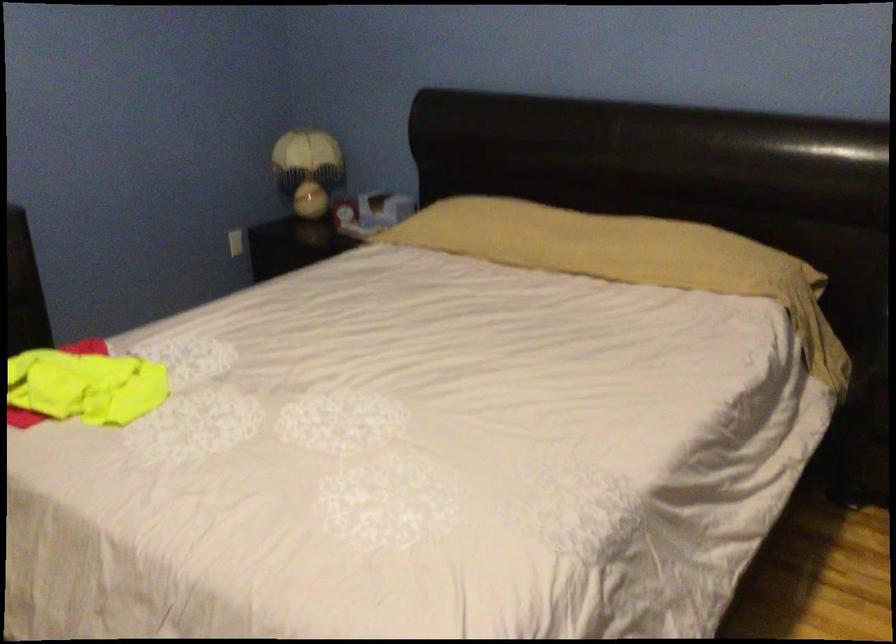
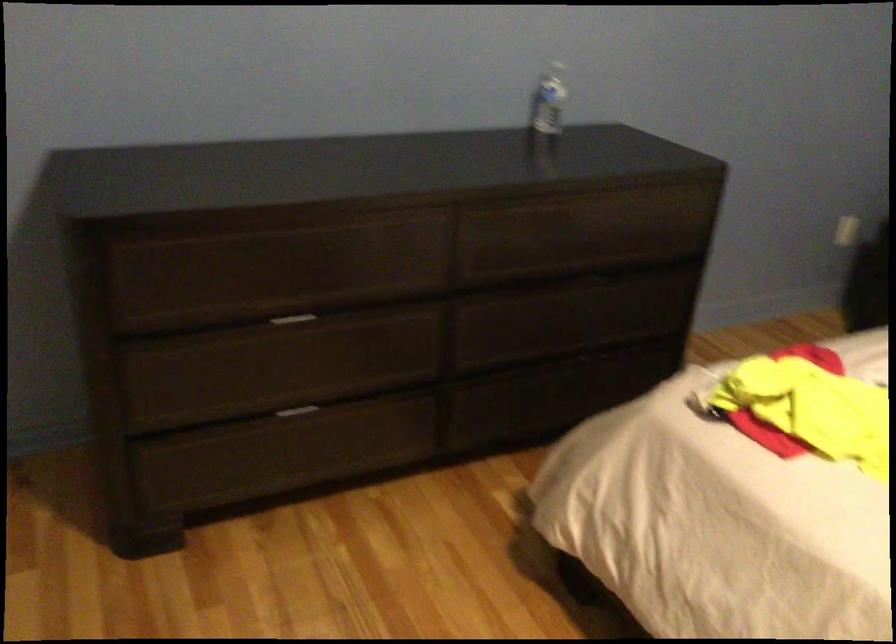
In the second image, find the point that corresponds to pixel 216 256 in the first image.

(848, 231)